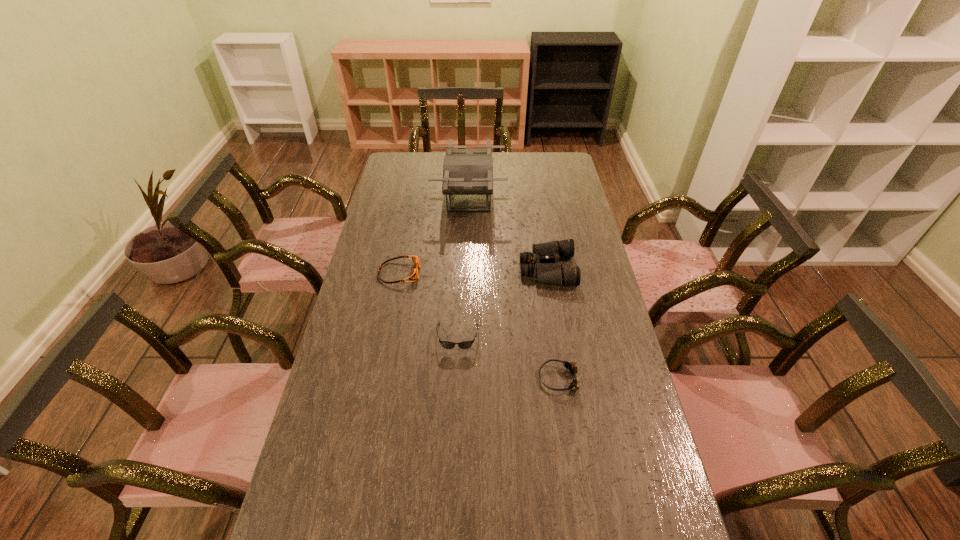
Locate an element on the screen. free location located 0.320m through the eyepieces of the binoculars is located at coordinates (434, 269).

You are a GUI agent. You are given a task and a screenshot of the screen. Output one action in this format:
    pyautogui.click(x=<x>, y=<y>)
    Task: Click on the free space located 0.340m through the eyepieces of the binoculars
    Image resolution: width=960 pixels, height=540 pixels.
    Given the screenshot: What is the action you would take?
    pyautogui.click(x=429, y=269)

The height and width of the screenshot is (540, 960). Find the location of `vacant region located on the front-facing side of the second nearest object`. vacant region located on the front-facing side of the second nearest object is located at coordinates point(451,476).

You are a GUI agent. You are given a task and a screenshot of the screen. Output one action in this format:
    pyautogui.click(x=<x>, y=<y>)
    Task: Click on the vacant space located with the lenses facing forward on the farther goggles
    
    Given the screenshot: What is the action you would take?
    pyautogui.click(x=466, y=273)

In order to click on vacant space located through the lenses of the nearest object in this screenshot , I will do `click(518, 379)`.

Identify the location of vacant region located through the lenses of the nearest object. The width and height of the screenshot is (960, 540). (420, 379).

Identify the location of vacant space located through the lenses of the nearest object. The image size is (960, 540). (474, 379).

Identify the location of object present at the far edge. This screenshot has height=540, width=960. (465, 171).

The width and height of the screenshot is (960, 540). Find the location of `object present at the left edge`. object present at the left edge is located at coordinates (414, 274).

At what (x,y) coordinates should I click in order to perform the action: click on binoculars that is at the right edge. Please return your answer as a coordinate pair (x, y). The image size is (960, 540). Looking at the image, I should click on (550, 273).